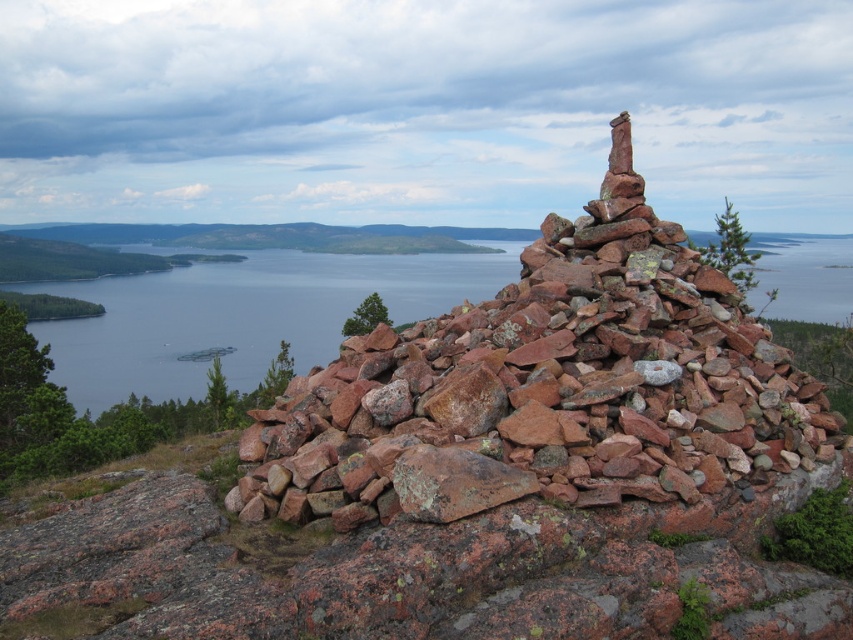
In the scene shown: Is rusty stone stack at center positioned before clear blue water at center?

Yes, it is in front of clear blue water at center.

Identify the location of rusty stone stack at center. (546, 387).

You are a GUI agent. You are given a task and a screenshot of the screen. Output one action in this format:
    pyautogui.click(x=<x>, y=<y>)
    Task: Click on the rusty stone stack at center
    This screenshot has height=640, width=853.
    Given the screenshot: What is the action you would take?
    pyautogui.click(x=546, y=387)